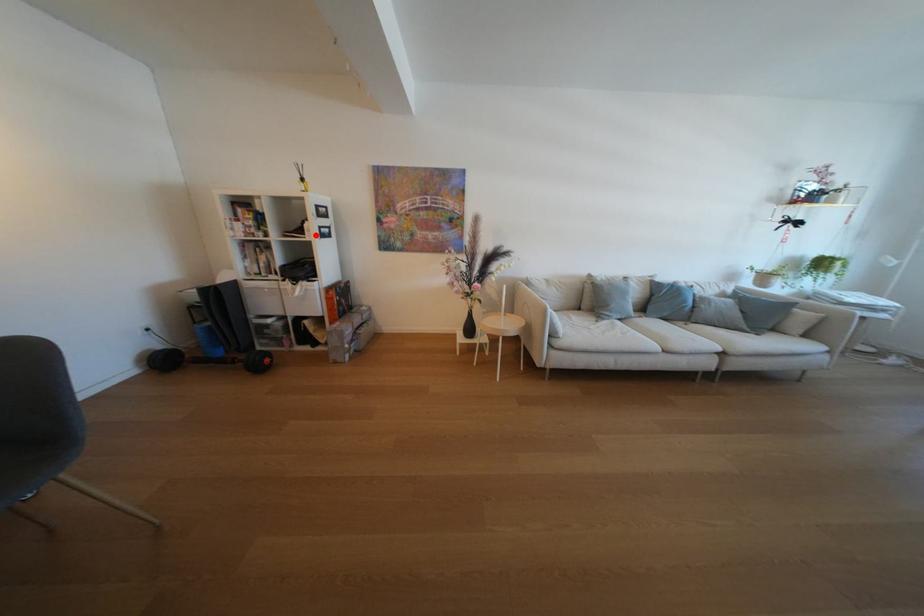
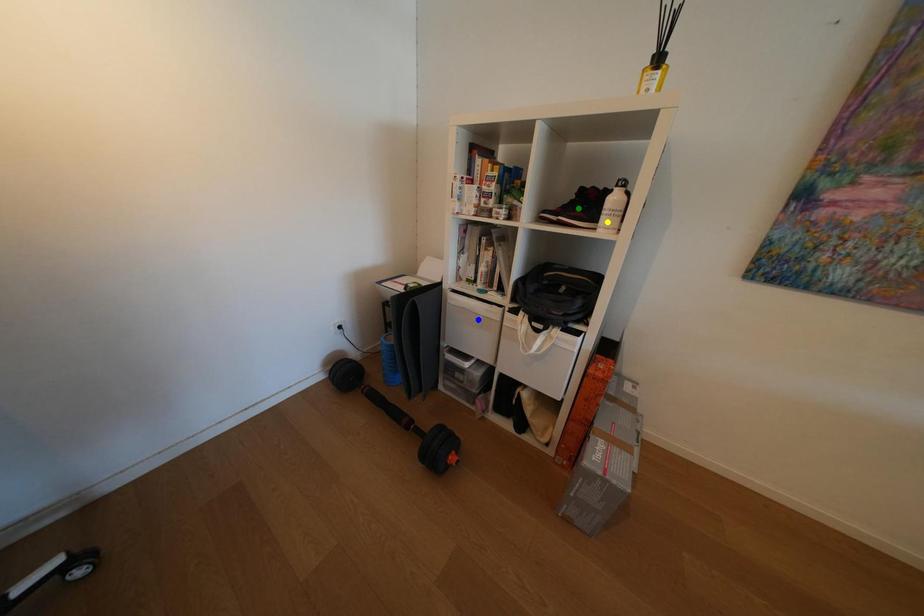
Question: I am providing you with two images of the same scene from different viewpoints. A red point is marked on the first image. You are given multiple points on the second image. Which point in image 2 is actually the same real-world point as the red point in image 1?

Choices:
 (A) yellow point
 (B) blue point
 (C) green point

Answer: (A)